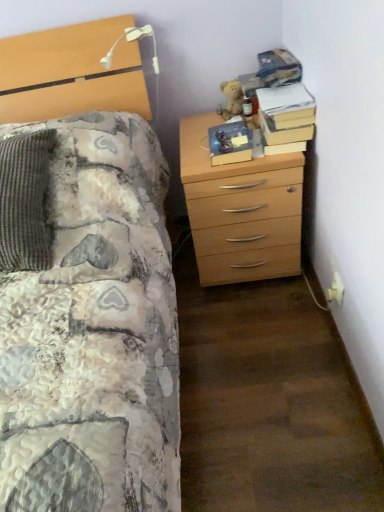
I want to click on vacant space situated above light wood chest of drawers at right (from a real-world perspective), so [220, 124].